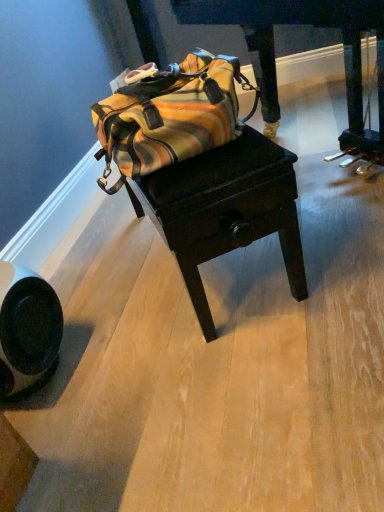
Question: Can you confirm if dark wood drawer at center is shorter than striped canvas duffel bag at center?

Choices:
 (A) no
 (B) yes

Answer: (A)

Question: Does dark wood drawer at center appear on the left side of striped canvas duffel bag at center?

Choices:
 (A) no
 (B) yes

Answer: (A)

Question: Is dark wood drawer at center in contact with striped canvas duffel bag at center?

Choices:
 (A) no
 (B) yes

Answer: (A)

Question: Considering the relative sizes of dark wood drawer at center and striped canvas duffel bag at center in the image provided, is dark wood drawer at center wider than striped canvas duffel bag at center?

Choices:
 (A) no
 (B) yes

Answer: (B)

Question: From the image's perspective, is dark wood drawer at center on striped canvas duffel bag at center?

Choices:
 (A) yes
 (B) no

Answer: (A)

Question: Is dark wood drawer at center at the right side of striped canvas duffel bag at center?

Choices:
 (A) yes
 (B) no

Answer: (A)

Question: From a real-world perspective, is wooden table at center physically below striped canvas duffel bag at center?

Choices:
 (A) yes
 (B) no

Answer: (A)

Question: Can you confirm if wooden table at center is positioned to the right of striped canvas duffel bag at center?

Choices:
 (A) yes
 (B) no

Answer: (A)

Question: Does wooden table at center have a lesser height compared to striped canvas duffel bag at center?

Choices:
 (A) no
 (B) yes

Answer: (A)

Question: From the image's perspective, is wooden table at center beneath striped canvas duffel bag at center?

Choices:
 (A) yes
 (B) no

Answer: (A)

Question: Is wooden table at center smaller than striped canvas duffel bag at center?

Choices:
 (A) yes
 (B) no

Answer: (B)

Question: Can you confirm if wooden table at center is thinner than striped canvas duffel bag at center?

Choices:
 (A) no
 (B) yes

Answer: (B)

Question: Is dark wood drawer at center surrounded by wooden table at center?

Choices:
 (A) no
 (B) yes

Answer: (A)